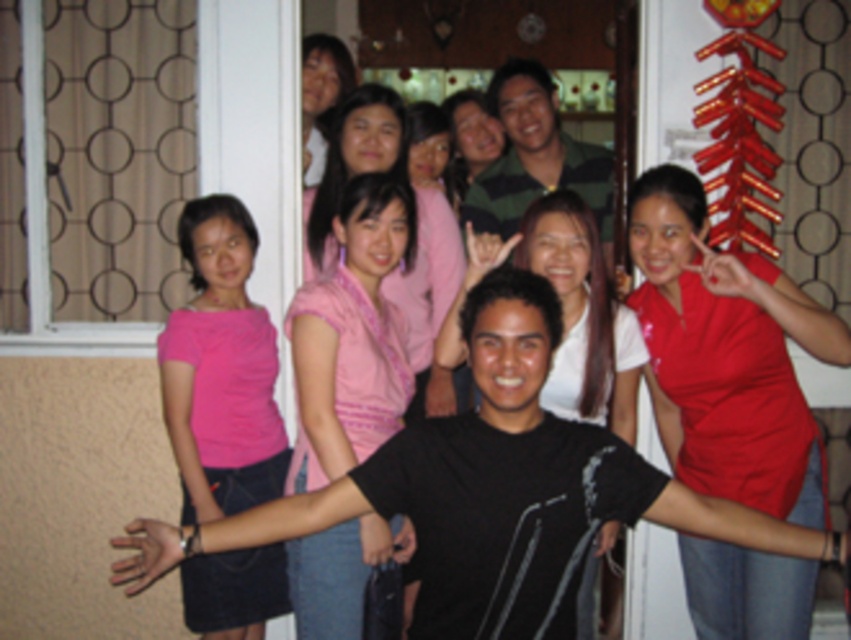
You are a photographer trying to focus on the pink satin blouse at center. Which object in the scene is exactly at the coordinates point (352, 337)?

The point (352, 337) corresponds to the pink satin blouse at center.